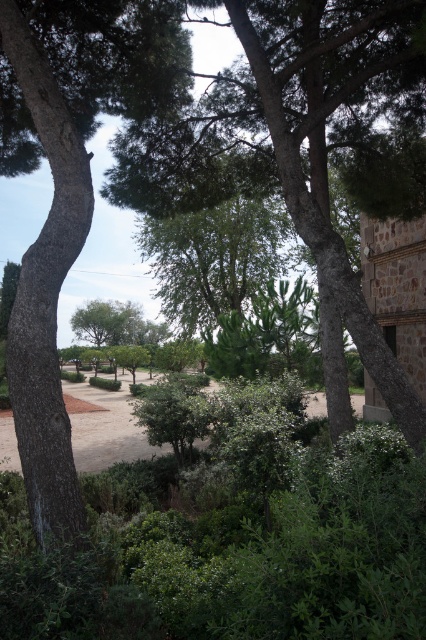
Question: Can you confirm if green leafy tree at center is thinner than brown dirt field at center?

Choices:
 (A) no
 (B) yes

Answer: (B)

Question: Which point is farther to the camera?

Choices:
 (A) green leafy tree at center
 (B) brown dirt field at center
 (C) green rough bark tree at left

Answer: (B)

Question: Does green leafy tree at center have a lesser width compared to green rough bark tree at left?

Choices:
 (A) no
 (B) yes

Answer: (B)

Question: Estimate the real-world distances between objects in this image. Which object is closer to the brown dirt field at center?

Choices:
 (A) green leafy tree at center
 (B) green rough bark tree at left

Answer: (B)

Question: Estimate the real-world distances between objects in this image. Which object is closer to the green leafy tree at center?

Choices:
 (A) green rough bark tree at left
 (B) brown dirt field at center

Answer: (A)

Question: Does green leafy tree at center appear on the right side of brown dirt field at center?

Choices:
 (A) no
 (B) yes

Answer: (B)